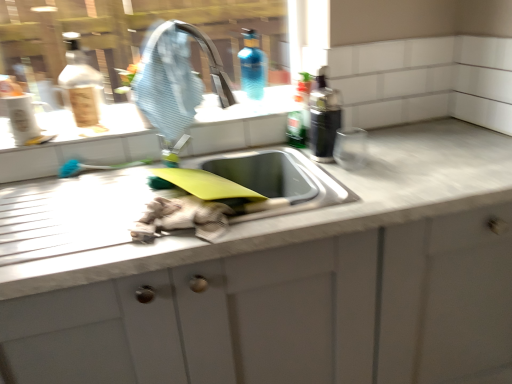
At what (x,y) coordinates should I click in order to perform the action: click on vacant space to the right of green glass bottle at upper right, marked as the 2th bottle in a right-to-left arrangement. Please return your answer as a coordinate pair (x, y). Image resolution: width=512 pixels, height=384 pixels. Looking at the image, I should click on (362, 140).